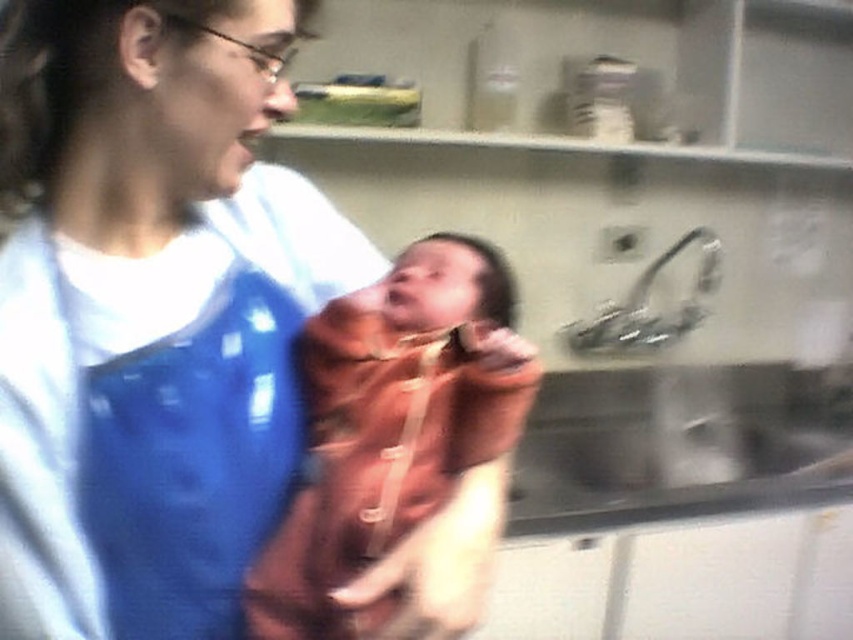
Consider the image. Between blue fabric shirt at center and soft brown blanket at center, which one appears on the left side from the viewer's perspective?

blue fabric shirt at center

The image size is (853, 640). What do you see at coordinates (149, 310) in the screenshot?
I see `blue fabric shirt at center` at bounding box center [149, 310].

The image size is (853, 640). What are the coordinates of `blue fabric shirt at center` in the screenshot? It's located at (149, 310).